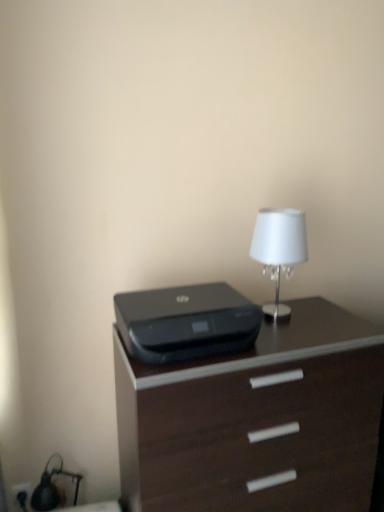
Question: Is dark wood chest of drawers at center smaller than black plastic printer at center?

Choices:
 (A) no
 (B) yes

Answer: (A)

Question: Is dark wood chest of drawers at center shorter than black plastic printer at center?

Choices:
 (A) no
 (B) yes

Answer: (A)

Question: Considering the relative positions of dark wood chest of drawers at center and black plastic printer at center in the image provided, is dark wood chest of drawers at center to the right of black plastic printer at center from the viewer's perspective?

Choices:
 (A) yes
 (B) no

Answer: (A)

Question: Is dark wood chest of drawers at center thinner than black plastic printer at center?

Choices:
 (A) no
 (B) yes

Answer: (A)

Question: Would you say dark wood chest of drawers at center contains black plastic printer at center?

Choices:
 (A) yes
 (B) no

Answer: (B)

Question: Can you confirm if dark wood chest of drawers at center is wider than black plastic printer at center?

Choices:
 (A) yes
 (B) no

Answer: (A)

Question: Is black plastic printer at center next to dark wood chest of drawers at center?

Choices:
 (A) no
 (B) yes

Answer: (A)

Question: Can you confirm if black plastic printer at center is positioned to the right of dark wood chest of drawers at center?

Choices:
 (A) yes
 (B) no

Answer: (B)

Question: Does black plastic printer at center turn towards dark wood chest of drawers at center?

Choices:
 (A) yes
 (B) no

Answer: (B)

Question: From the image's perspective, does black plastic printer at center appear higher than dark wood chest of drawers at center?

Choices:
 (A) yes
 (B) no

Answer: (A)

Question: Considering the relative sizes of black plastic printer at center and dark wood chest of drawers at center in the image provided, is black plastic printer at center bigger than dark wood chest of drawers at center?

Choices:
 (A) yes
 (B) no

Answer: (B)

Question: Does black plastic printer at center have a greater height compared to dark wood chest of drawers at center?

Choices:
 (A) no
 (B) yes

Answer: (A)

Question: Considering the positions of black plastic printer at center and dark wood chest of drawers at center in the image, is black plastic printer at center taller or shorter than dark wood chest of drawers at center?

Choices:
 (A) tall
 (B) short

Answer: (B)